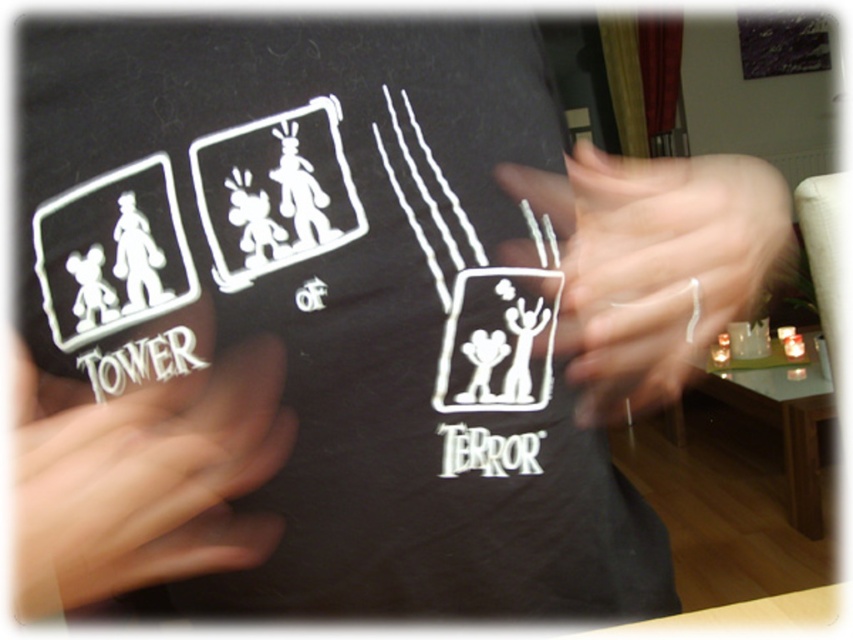
Does black matte t-shirt at center lie behind white matte hand at lower left?

Yes, it is.

Is black matte t-shirt at center wider than white matte hand at lower left?

Indeed, black matte t-shirt at center has a greater width compared to white matte hand at lower left.

Who is more forward, (251, 332) or (225, 515)?

Point (251, 332) is in front.

Locate an element on the screen. black matte t-shirt at center is located at coordinates (341, 298).

Which of these two, white matte ring at upper right or white metallic lettering at center, stands shorter?

white metallic lettering at center is shorter.

Can you confirm if white matte ring at upper right is positioned to the left of white metallic lettering at center?

Incorrect, white matte ring at upper right is not on the left side of white metallic lettering at center.

Is point (612, 385) farther from camera compared to point (76, 364)?

Yes, point (612, 385) is farther from viewer.

This screenshot has height=640, width=853. I want to click on white matte ring at upper right, so click(653, 264).

Can you confirm if white matte hand at lower left is taller than white metallic lettering at center?

Yes.

Is the position of white matte hand at lower left more distant than that of white metallic lettering at center?

No, it is in front of white metallic lettering at center.

The width and height of the screenshot is (853, 640). Describe the element at coordinates (143, 480) in the screenshot. I see `white matte hand at lower left` at that location.

Locate an element on the screen. white matte hand at lower left is located at coordinates (143, 480).